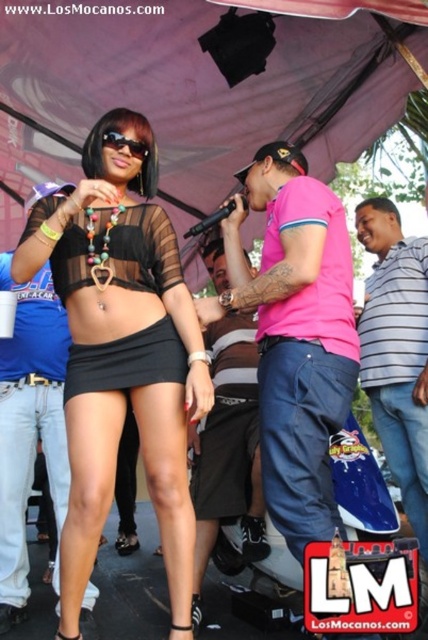
Question: Which point is closer to the camera?

Choices:
 (A) (86, 364)
 (B) (67, 371)
 (C) (267, 316)
 (D) (0, 266)

Answer: (A)

Question: Among these objects, which one is farthest from the camera?

Choices:
 (A) black matte skirt at center
 (B) black mesh skirt at center
 (C) black sheer top at center
 (D) pink fabric shirt at center

Answer: (B)

Question: Considering the relative positions of black sheer top at center and black matte skirt at center in the image provided, where is black sheer top at center located with respect to black matte skirt at center?

Choices:
 (A) above
 (B) below

Answer: (A)

Question: Which object is closer to the camera taking this photo?

Choices:
 (A) black matte skirt at center
 (B) pink fabric shirt at center
 (C) black sheer top at center
 (D) black mesh skirt at center

Answer: (B)

Question: Is pink fabric shirt at center above black mesh skirt at center?

Choices:
 (A) no
 (B) yes

Answer: (B)

Question: Does black sheer top at center have a lesser width compared to black mesh skirt at center?

Choices:
 (A) no
 (B) yes

Answer: (A)